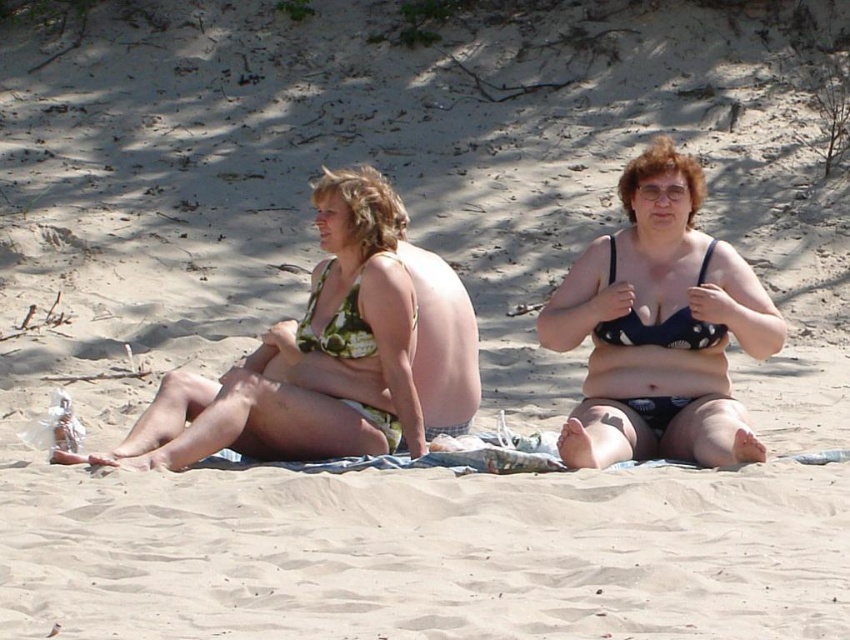
You are a photographer trying to capture both the matte black bikini top at center and the green floral bikini at left in a single frame. Since the camera can only focus on objects within a 1.2 meter width, will both fit if you position the camera to include both?

The matte black bikini top at center has a lesser width compared to the green floral bikini at left. However, without knowing the exact combined width of both objects, it is impossible to determine if they will fit within the 1.2 meter width constraint.

You are a photographer trying to capture a photo of the two people on the beach. You notice the green floral bikini at left and the green floral bikini top at center. Which one is positioned lower in the image?

The green floral bikini at left is located below the green floral bikini top at center, so the green floral bikini at left is positioned lower in the image.

You are a lifeguard on duty and need to check if two sunbathers are within the required 5 feet safety distance. The two sunbathers are wearing the matte black bikini top at center and the green floral bikini at left. Are they within the safety distance?

The distance between the matte black bikini top at center and the green floral bikini at left is 4.54 feet, which is less than the required 5 feet safety distance. Therefore, they are within the safety distance.